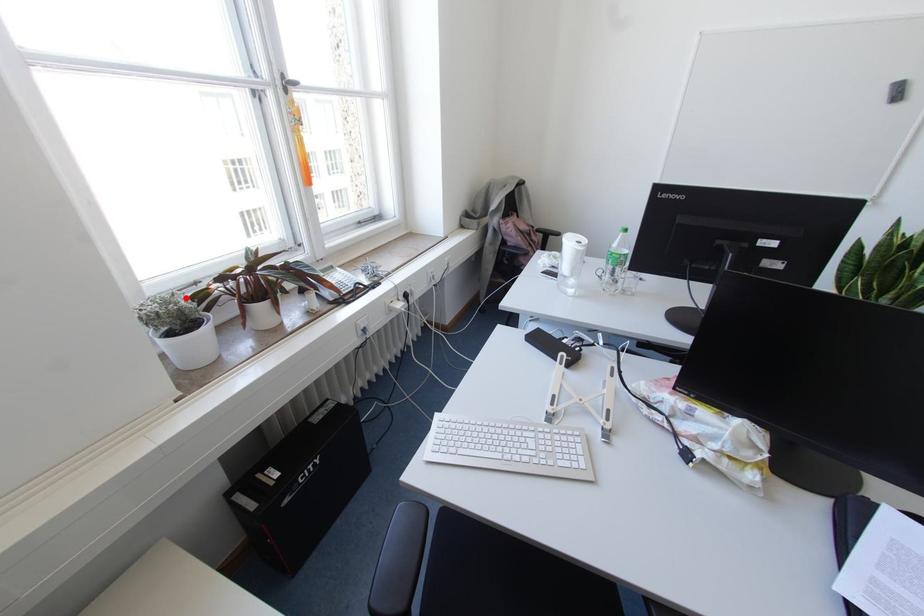
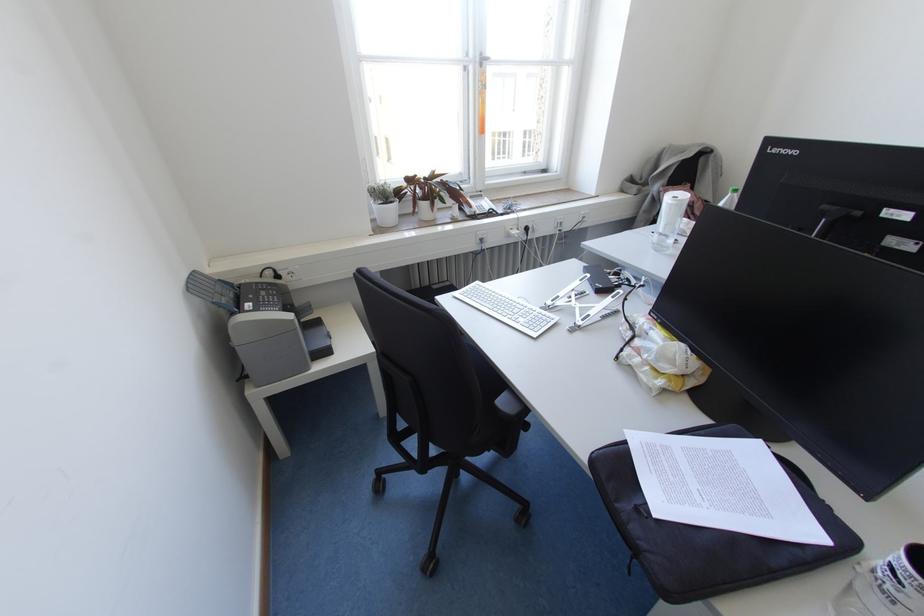
Question: I am providing you with two images of the same scene from different viewpoints. Given a red point in image1, look at the same physical point in image2. Is it:

Choices:
 (A) Closer to the viewpoint
 (B) Farther from the viewpoint

Answer: (A)